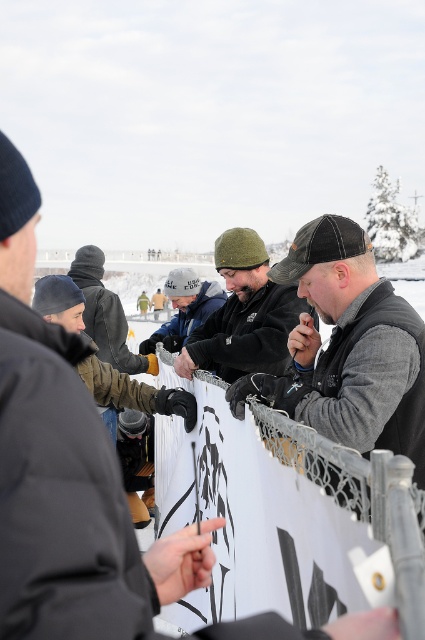
Question: Which point appears closest to the camera in this image?

Choices:
 (A) (105, 298)
 (B) (231, 324)
 (C) (197, 296)

Answer: (B)

Question: Is gray woolen sweater at center positioned in front of dark gray knit cap at center?

Choices:
 (A) yes
 (B) no

Answer: (A)

Question: Can you confirm if dark gray knit cap at center is positioned to the right of white knit cap at center?

Choices:
 (A) yes
 (B) no

Answer: (B)

Question: Which of the following is the farthest from the observer?

Choices:
 (A) dark gray knit cap at center
 (B) matte black jacket at center
 (C) gray woolen sweater at center
 (D) white knit cap at center

Answer: (D)

Question: Which of the following is the closest to the observer?

Choices:
 (A) (173, 269)
 (B) (113, 362)
 (C) (405, 333)

Answer: (C)

Question: Can you confirm if gray woolen sweater at center is thinner than white knit cap at center?

Choices:
 (A) no
 (B) yes

Answer: (B)